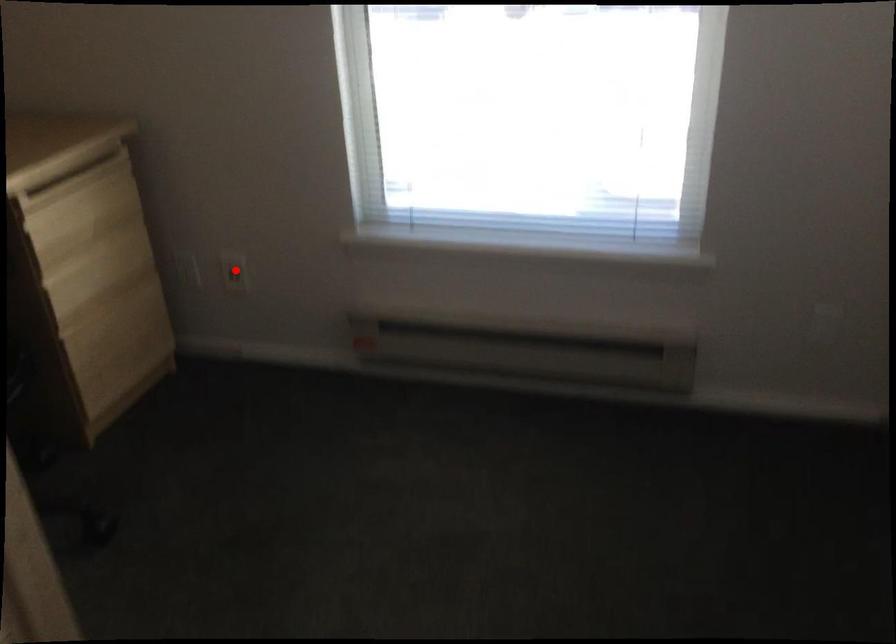
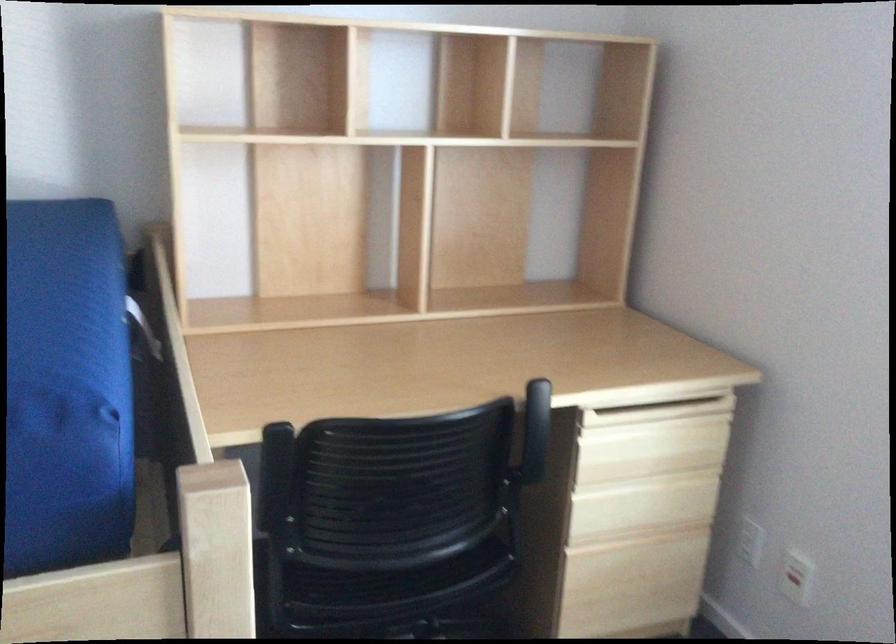
In the second image, find the point that corresponds to the highlighted location in the first image.

(796, 576)